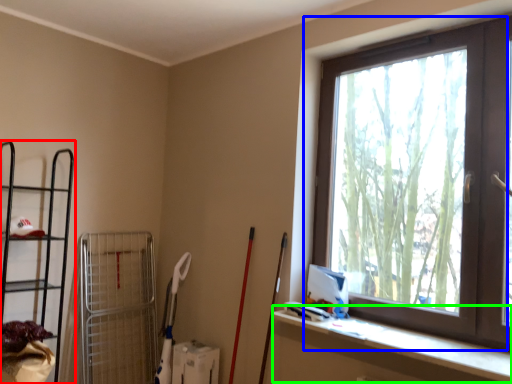
Question: Which object is positioned closest to shelf (highlighted by a red box)? Select from window (highlighted by a blue box) and ledge (highlighted by a green box).

Choices:
 (A) window
 (B) ledge

Answer: (B)